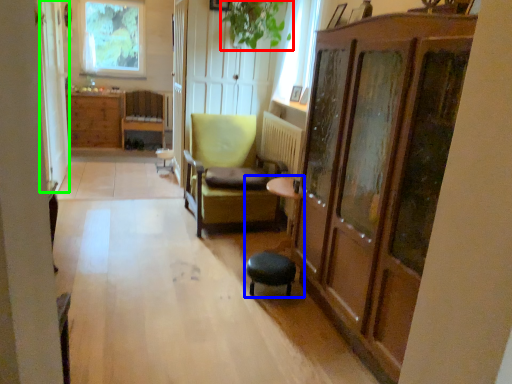
Question: Based on their relative distances, which object is farther from plant (highlighted by a red box)? Choose from swivel chair (highlighted by a blue box) and screen door (highlighted by a green box).

Choices:
 (A) swivel chair
 (B) screen door

Answer: (A)